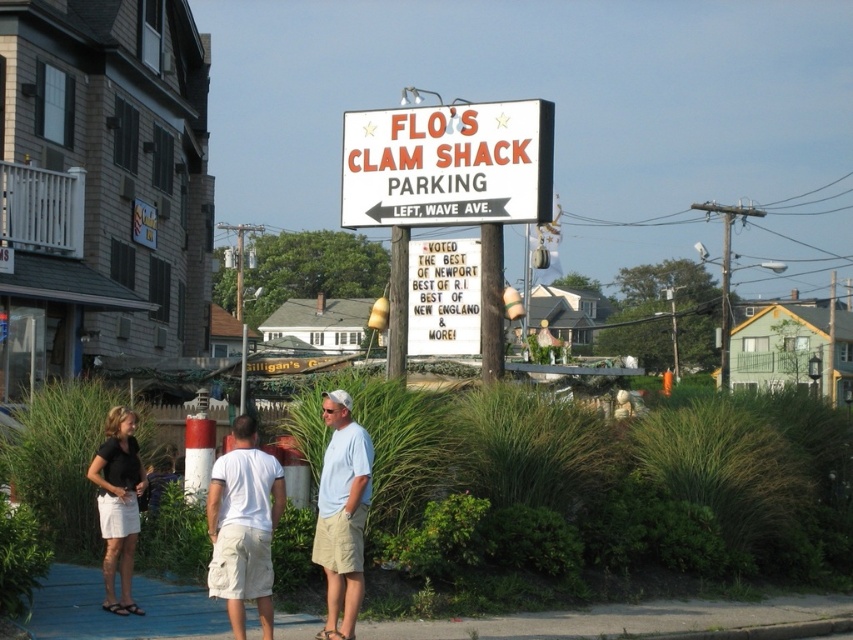
Who is positioned more to the left, white cotton shirt at center or light beige shorts at center?

From the viewer's perspective, white cotton shirt at center appears more on the left side.

Who is taller, white cotton shirt at center or light beige shorts at center?

With more height is white cotton shirt at center.

Is point (267, 486) behind point (332, 589)?

No, (267, 486) is in front of (332, 589).

The height and width of the screenshot is (640, 853). What are the coordinates of `white cotton shirt at center` in the screenshot? It's located at click(242, 524).

Does white cotton t-shirt at center have a greater height compared to light beige shorts at center?

No, white cotton t-shirt at center is not taller than light beige shorts at center.

Is white cotton t-shirt at center thinner than light beige shorts at center?

Incorrect, white cotton t-shirt at center's width is not less than light beige shorts at center's.

This screenshot has height=640, width=853. In order to click on white cotton t-shirt at center in this screenshot , I will do `click(242, 525)`.

From the picture: Does blue concrete pavement at lower center have a larger size compared to light beige shorts at center?

Yes.

Between point (70, 637) and point (334, 512), which one is positioned in front?

Point (70, 637) is more forward.

Is point (440, 620) less distant than point (334, 419)?

No, it is not.

Identify the location of blue concrete pavement at lower center. This screenshot has width=853, height=640. (618, 618).